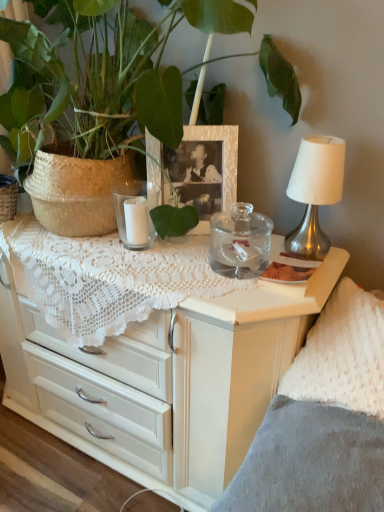
Question: Is white textured picture frame at center thinner than white glass candle at center, acting as the 1th candle holder starting from the left?

Choices:
 (A) no
 (B) yes

Answer: (B)

Question: From a real-world perspective, is white textured picture frame at center physically above white glass candle at center, placed as the second candle holder when sorted from right to left?

Choices:
 (A) yes
 (B) no

Answer: (A)

Question: Does white textured picture frame at center have a smaller size compared to white glass candle at center, placed as the second candle holder when sorted from right to left?

Choices:
 (A) yes
 (B) no

Answer: (B)

Question: Is white textured picture frame at center next to white glass candle at center, placed as the second candle holder when sorted from right to left?

Choices:
 (A) yes
 (B) no

Answer: (B)

Question: Is white glass candle at center, placed as the second candle holder when sorted from right to left, completely or partially inside white textured picture frame at center?

Choices:
 (A) no
 (B) yes

Answer: (A)

Question: Considering their positions, is white fluffy pillow at right located in front of or behind white textured picture frame at center?

Choices:
 (A) behind
 (B) front

Answer: (B)

Question: From a real-world perspective, is white fluffy pillow at right above or below white textured picture frame at center?

Choices:
 (A) below
 (B) above

Answer: (A)

Question: Looking at the image, does white fluffy pillow at right seem bigger or smaller compared to white textured picture frame at center?

Choices:
 (A) big
 (B) small

Answer: (A)

Question: Choose the correct answer: Is white fluffy pillow at right inside white textured picture frame at center or outside it?

Choices:
 (A) outside
 (B) inside

Answer: (A)

Question: In terms of height, does transparent glass jar at center, marked as the second candle holder in a left-to-right arrangement, look taller or shorter compared to white fluffy pillow at right?

Choices:
 (A) short
 (B) tall

Answer: (A)

Question: Considering the positions of transparent glass jar at center, marked as the second candle holder in a left-to-right arrangement, and white fluffy pillow at right in the image, is transparent glass jar at center, marked as the second candle holder in a left-to-right arrangement, wider or thinner than white fluffy pillow at right?

Choices:
 (A) wide
 (B) thin

Answer: (B)

Question: Is point (249, 261) closer or farther from the camera than point (283, 389)?

Choices:
 (A) closer
 (B) farther

Answer: (B)

Question: Which is correct: transparent glass jar at center, positioned as the 1th candle holder in right-to-left order, is inside white fluffy pillow at right, or outside of it?

Choices:
 (A) outside
 (B) inside

Answer: (A)

Question: Considering their positions, is transparent glass jar at center, positioned as the 1th candle holder in right-to-left order, located in front of or behind white glass candle at center, acting as the 1th candle holder starting from the left?

Choices:
 (A) behind
 (B) front

Answer: (B)

Question: From a real-world perspective, relative to white glass candle at center, acting as the 1th candle holder starting from the left, is transparent glass jar at center, positioned as the 1th candle holder in right-to-left order, vertically above or below?

Choices:
 (A) above
 (B) below

Answer: (B)